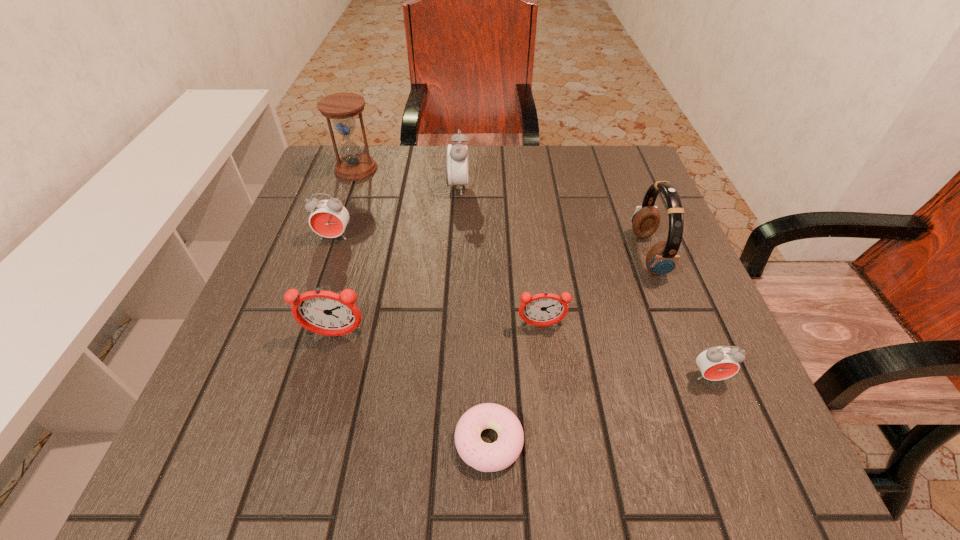
This screenshot has width=960, height=540. What are the coordinates of `vacant position located 0.070m on the front-facing side of the sixth object from left to right` in the screenshot? It's located at (546, 364).

Locate an element on the screen. This screenshot has width=960, height=540. blank space located on the face of the smallest red alarm clock is located at coordinates (730, 427).

At what (x,y) coordinates should I click in order to perform the action: click on blank space located on the right of the pink doughnut. Please return your answer as a coordinate pair (x, y). Looking at the image, I should click on (721, 441).

Identify the location of hourglass at the far edge. Image resolution: width=960 pixels, height=540 pixels. (341, 107).

Where is `alarm clock located at the far edge`? This screenshot has width=960, height=540. alarm clock located at the far edge is located at coordinates (456, 159).

In order to click on object present at the near edge in this screenshot , I will do `click(487, 457)`.

This screenshot has width=960, height=540. I want to click on hourglass situated at the left edge, so click(341, 107).

Find the location of a particular element. headset located at the right edge is located at coordinates (662, 258).

Locate an element on the screen. alarm clock situated at the right edge is located at coordinates (716, 363).

The height and width of the screenshot is (540, 960). In order to click on object situated at the far left corner in this screenshot , I will do `click(341, 107)`.